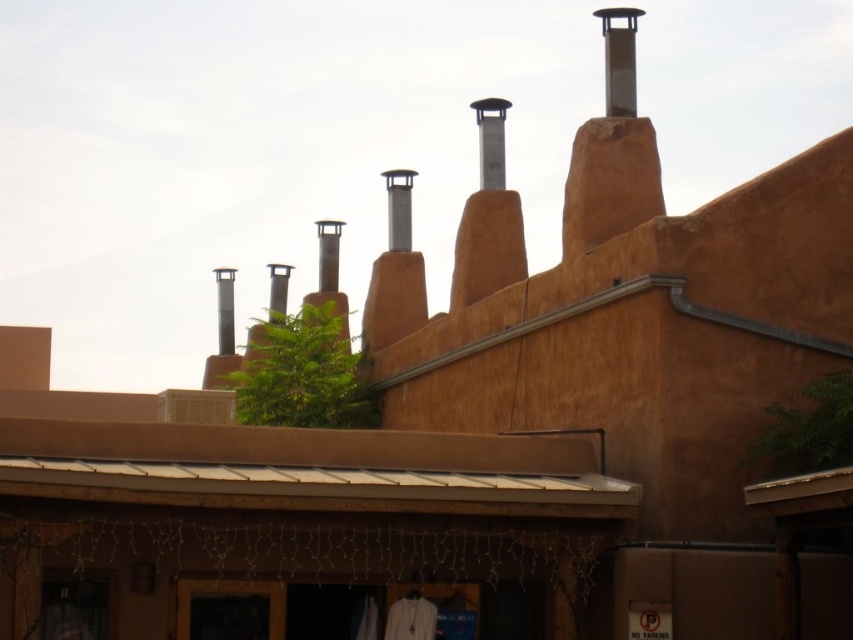
Question: Is smooth silver chimney at upper right smaller than satin silver chimney at upper center?

Choices:
 (A) no
 (B) yes

Answer: (B)

Question: Among these points, which one is nearest to the camera?

Choices:
 (A) (618, 68)
 (B) (495, 173)

Answer: (A)

Question: Considering the relative positions of smooth silver chimney at upper right and satin silver chimney at upper center in the image provided, where is smooth silver chimney at upper right located with respect to satin silver chimney at upper center?

Choices:
 (A) left
 (B) right

Answer: (B)

Question: Can you confirm if smooth silver chimney at upper right is positioned to the right of satin silver chimney at upper center?

Choices:
 (A) no
 (B) yes

Answer: (B)